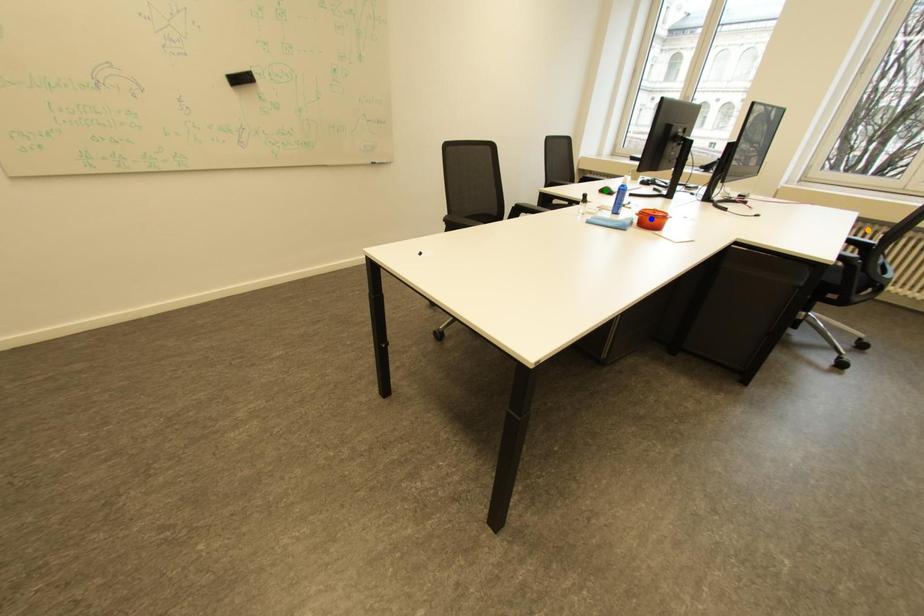
Order these from farthest to nearest:
A) orange point
B) green point
C) blue point

orange point, green point, blue point